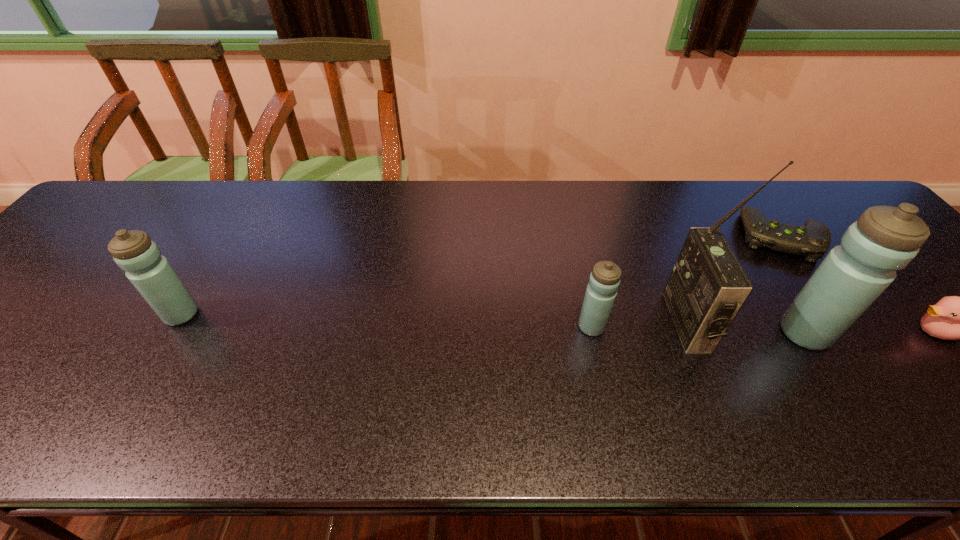
Locate an element on the screen. Image resolution: width=960 pixels, height=540 pixels. blank space at the far left corner is located at coordinates (139, 192).

In the image, there is a desktop. At what (x,y) coordinates should I click in order to perform the action: click on vacant space at the far right corner. Please return your answer as a coordinate pair (x, y). The image size is (960, 540). Looking at the image, I should click on (796, 189).

Image resolution: width=960 pixels, height=540 pixels. In order to click on vacant space in between the shortest water bottle and the leftmost object in this screenshot , I will do `click(387, 321)`.

This screenshot has width=960, height=540. I want to click on free point between the shortest object and the tallest water bottle, so click(x=792, y=285).

This screenshot has width=960, height=540. I want to click on free space between the fourth shortest object and the fifth object from right to left, so click(387, 321).

Find the location of a particular element. This screenshot has height=540, width=960. empty space between the leftmost object and the tallest object is located at coordinates (434, 319).

Choose which object is the fifth nearest neighbor to the second object from left to right. Please provide its 2D coordinates. Your answer should be formatted as a tuple, i.e. [(x, y)], where the tuple contains the x and y coordinates of a point satisfying the conditions above.

[(152, 275)]

Choose which object is the fourth nearest neighbor to the rightmost water bottle. Please provide its 2D coordinates. Your answer should be formatted as a tuple, i.e. [(x, y)], where the tuple contains the x and y coordinates of a point satisfying the conditions above.

[(604, 281)]

The image size is (960, 540). Identify the location of the closest water bottle relative to the shortest object. (884, 239).

This screenshot has height=540, width=960. In order to click on the third closest water bottle to the second shortest object in this screenshot , I will do `click(152, 275)`.